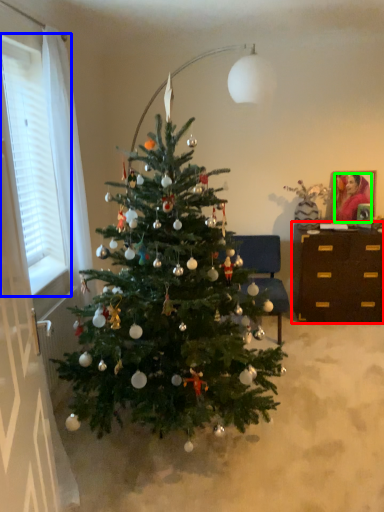
Question: Which is nearer to the desk (highlighted by a red box)? window (highlighted by a blue box) or person (highlighted by a green box).

Choices:
 (A) window
 (B) person

Answer: (B)